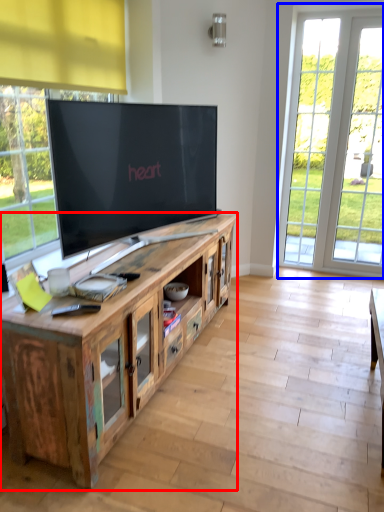
Question: Which object appears closest to the camera in this image, cabinetry (highlighted by a red box) or window (highlighted by a blue box)?

Choices:
 (A) cabinetry
 (B) window

Answer: (A)